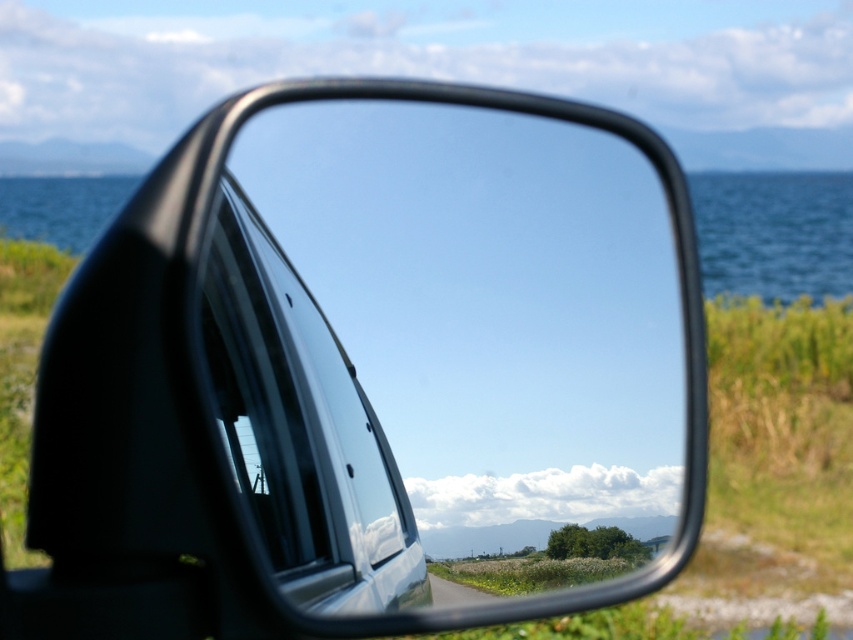
Does black glossy mirror at center appear on the right side of transparent glass car window at center?

No, black glossy mirror at center is not to the right of transparent glass car window at center.

Is point (505, 348) farther from camera compared to point (331, 560)?

Yes, point (505, 348) is farther from viewer.

Locate an element on the screen. black glossy mirror at center is located at coordinates (370, 372).

In the scene shown: Which is above, black glossy mirror at center or blue water at center?

blue water at center is higher up.

Measure the distance between black glossy mirror at center and camera.

black glossy mirror at center is 29.09 inches away from camera.

The image size is (853, 640). In order to click on black glossy mirror at center in this screenshot , I will do `click(370, 372)`.

Looking at this image, does transparent glass car window at center have a larger size compared to blue water at center?

No, transparent glass car window at center is not bigger than blue water at center.

This screenshot has height=640, width=853. I want to click on transparent glass car window at center, so click(302, 429).